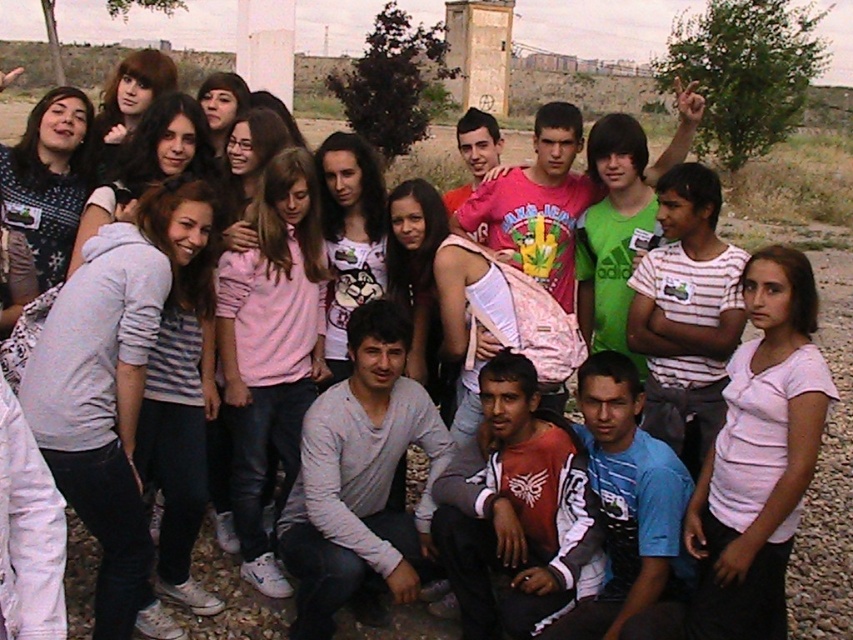
You are a photographer trying to adjust the focus of your camera to capture both the light gray sweater at center and the white striped shirt at center. Which one is closer to the camera?

The light gray sweater at center is positioned under the white striped shirt at center, so it is closer to the camera.

You are a photographer trying to capture a clear shot of the light gray sweater at center and the white striped shirt at center. Since both are at the center, which one is closer to the camera?

The light gray sweater at center is in front of the white striped shirt at center, so it is closer to the camera.